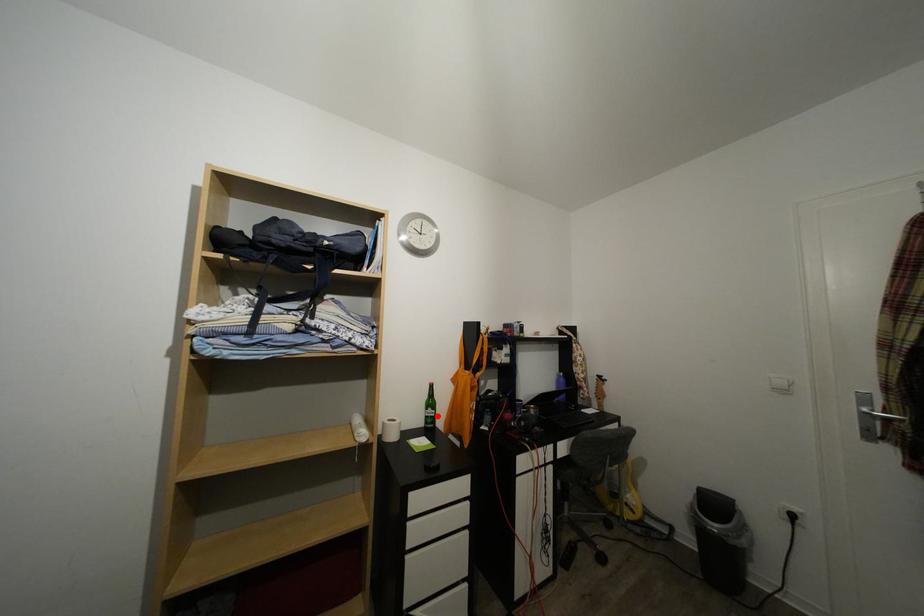
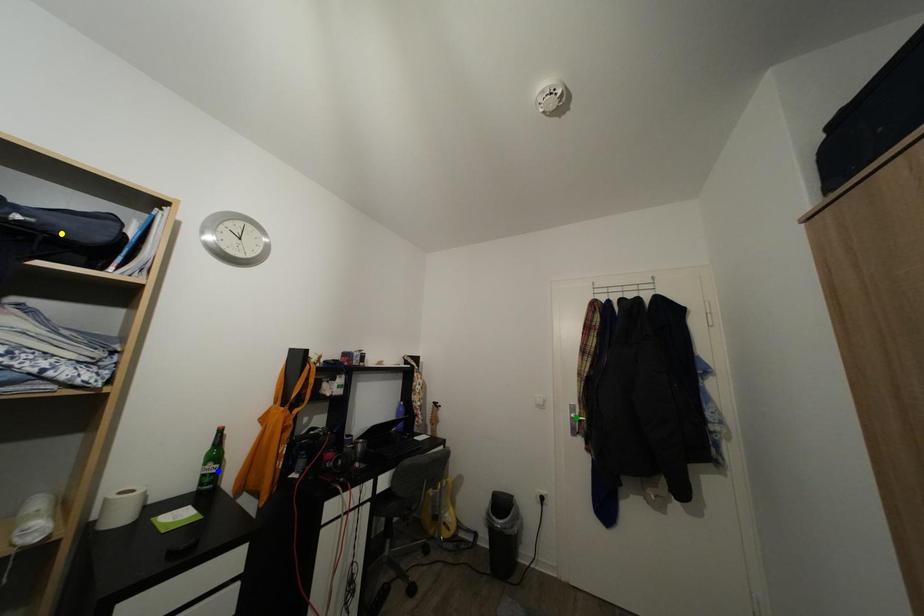
Question: I am providing you with two images of the same scene from different viewpoints. A red point is marked on the first image. You are given multiple points on the second image. Which mark in image 2 goes with the point in image 1?

Choices:
 (A) yellow point
 (B) green point
 (C) blue point

Answer: (C)